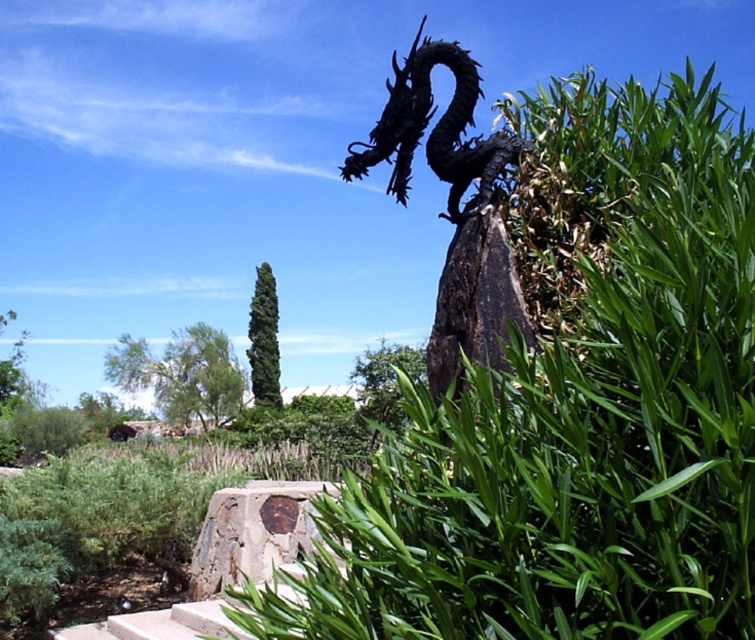
Is black metal dragon at upper center further to the viewer compared to rusty concrete block at center?

No.

What do you see at coordinates (433, 129) in the screenshot? I see `black metal dragon at upper center` at bounding box center [433, 129].

Image resolution: width=755 pixels, height=640 pixels. What do you see at coordinates (433, 129) in the screenshot?
I see `black metal dragon at upper center` at bounding box center [433, 129].

This screenshot has height=640, width=755. Identify the location of black metal dragon at upper center. (433, 129).

Is black metal dragon at upper center to the left of green leafy bush at center from the viewer's perspective?

Incorrect, black metal dragon at upper center is not on the left side of green leafy bush at center.

Identify the location of black metal dragon at upper center. (433, 129).

Where is `black metal dragon at upper center`? The height and width of the screenshot is (640, 755). black metal dragon at upper center is located at coordinates (433, 129).

Who is more forward, (307, 534) or (273, 364)?

Point (307, 534)

From the picture: Is rusty concrete block at center to the right of green leafy bush at center from the viewer's perspective?

Yes, rusty concrete block at center is to the right of green leafy bush at center.

Locate an element on the screen. This screenshot has width=755, height=640. rusty concrete block at center is located at coordinates (251, 532).